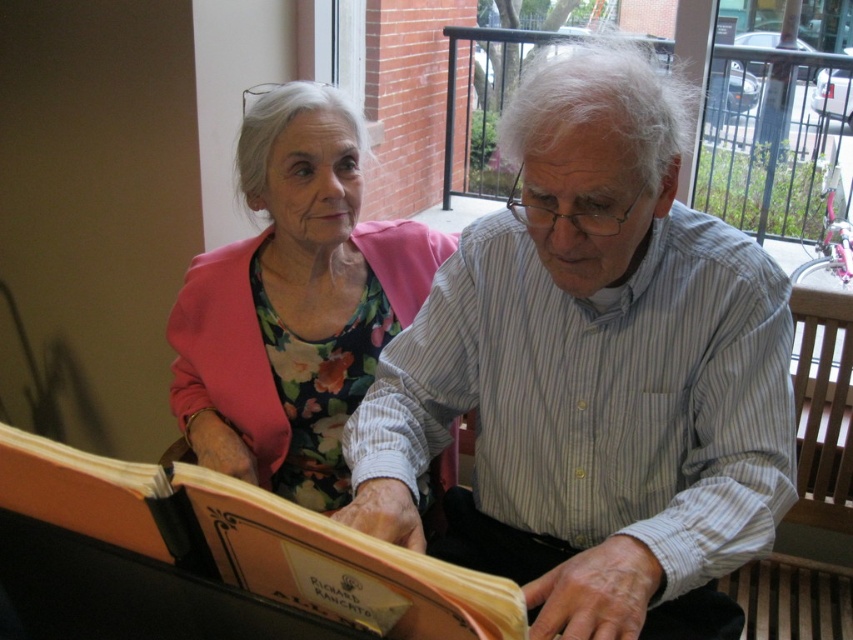
You are a photographer taking a picture of the scene. The floral fabric dress at upper left and the orange paper book at center are both in the frame. Which object is closer to the camera?

The orange paper book at center is behind the floral fabric dress at upper left, so the floral fabric dress at upper left is closer to the camera.

What are the coordinates of the white striped shirt at center?

The white striped shirt at center is located at coordinates point [593,374].